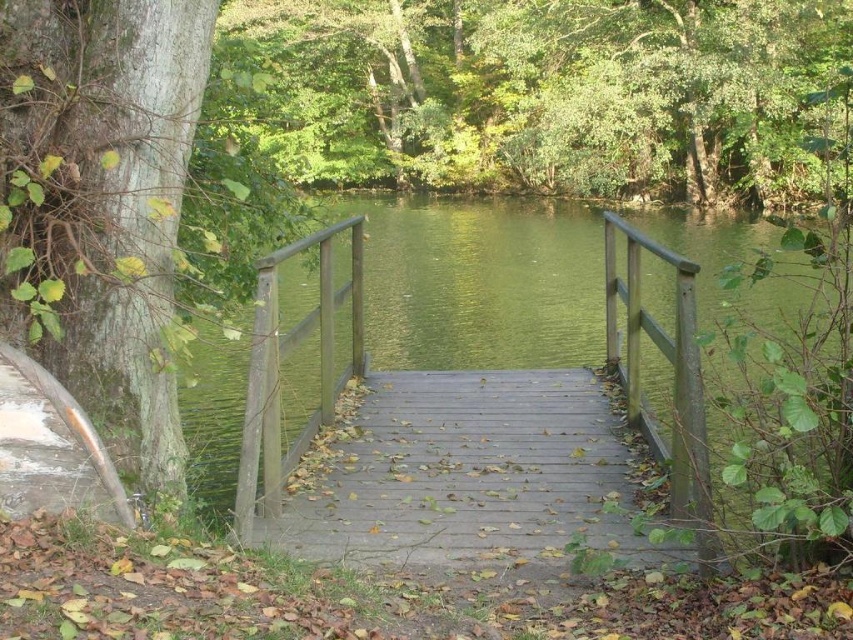
Between green rough bark tree at left and wooden bridge at center, which one is positioned lower?

Positioned lower is wooden bridge at center.

Is green rough bark tree at left shorter than wooden bridge at center?

In fact, green rough bark tree at left may be taller than wooden bridge at center.

Is point (112, 323) positioned in front of point (608, 481)?

Yes, it is in front of point (608, 481).

At what (x,y) coordinates should I click in order to perform the action: click on green rough bark tree at left. Please return your answer as a coordinate pair (x, y). Looking at the image, I should click on (99, 234).

Is green rough bark tree at left to the left of wooden rail at center from the viewer's perspective?

Correct, you'll find green rough bark tree at left to the left of wooden rail at center.

Is green rough bark tree at left shorter than wooden rail at center?

No, green rough bark tree at left is not shorter than wooden rail at center.

Who is more distant from viewer, (x=120, y=448) or (x=334, y=388)?

Positioned behind is point (x=334, y=388).

At what (x,y) coordinates should I click in order to perform the action: click on green rough bark tree at left. Please return your answer as a coordinate pair (x, y). Looking at the image, I should click on (99, 234).

The width and height of the screenshot is (853, 640). What do you see at coordinates (567, 93) in the screenshot?
I see `green leafy tree at upper center` at bounding box center [567, 93].

Is green leafy tree at upper center bigger than green rough bark tree at left?

Yes, green leafy tree at upper center is bigger than green rough bark tree at left.

The image size is (853, 640). What do you see at coordinates (567, 93) in the screenshot?
I see `green leafy tree at upper center` at bounding box center [567, 93].

At what (x,y) coordinates should I click in order to perform the action: click on green leafy tree at upper center. Please return your answer as a coordinate pair (x, y). The height and width of the screenshot is (640, 853). Looking at the image, I should click on (567, 93).